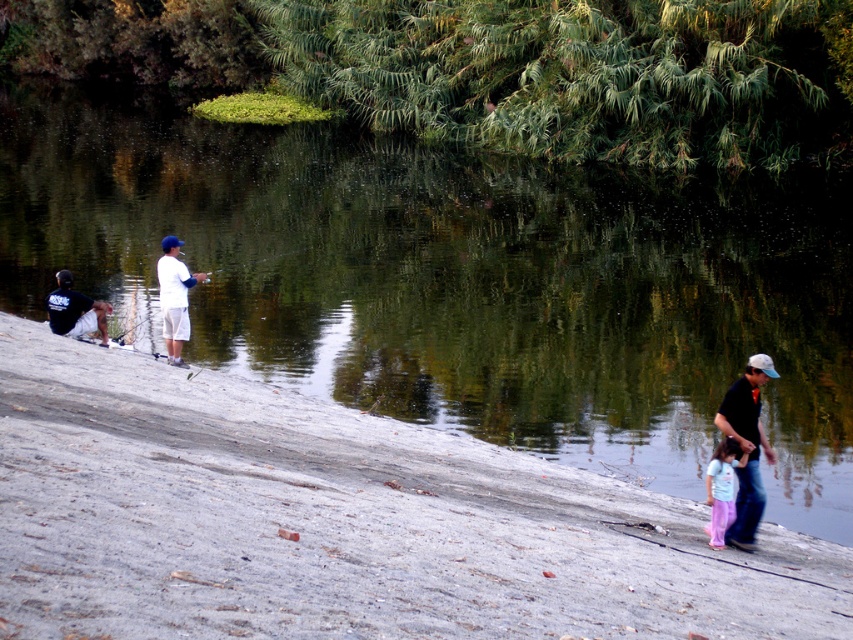
Can you confirm if green reflective water at center is smaller than dark blue t-shirt at left?

No, green reflective water at center is not smaller than dark blue t-shirt at left.

Who is higher up, green reflective water at center or dark blue t-shirt at left?

green reflective water at center is higher up.

What do you see at coordinates (457, 284) in the screenshot?
I see `green reflective water at center` at bounding box center [457, 284].

Image resolution: width=853 pixels, height=640 pixels. In order to click on green reflective water at center in this screenshot , I will do `click(457, 284)`.

Is sandy shore at lower left smaller than white matte baseball cap at upper center?

Actually, sandy shore at lower left might be larger than white matte baseball cap at upper center.

Which is more to the left, sandy shore at lower left or white matte baseball cap at upper center?

white matte baseball cap at upper center is more to the left.

Is point (636, 582) in front of point (171, 364)?

Yes.

The height and width of the screenshot is (640, 853). Identify the location of sandy shore at lower left. (341, 522).

Locate an element on the screen. matte black shirt at lower right is located at coordinates (747, 445).

Is matte black shirt at lower right in front of white matte baseball cap at upper center?

Yes, it is.

The height and width of the screenshot is (640, 853). Identify the location of matte black shirt at lower right. (747, 445).

I want to click on matte black shirt at lower right, so click(x=747, y=445).